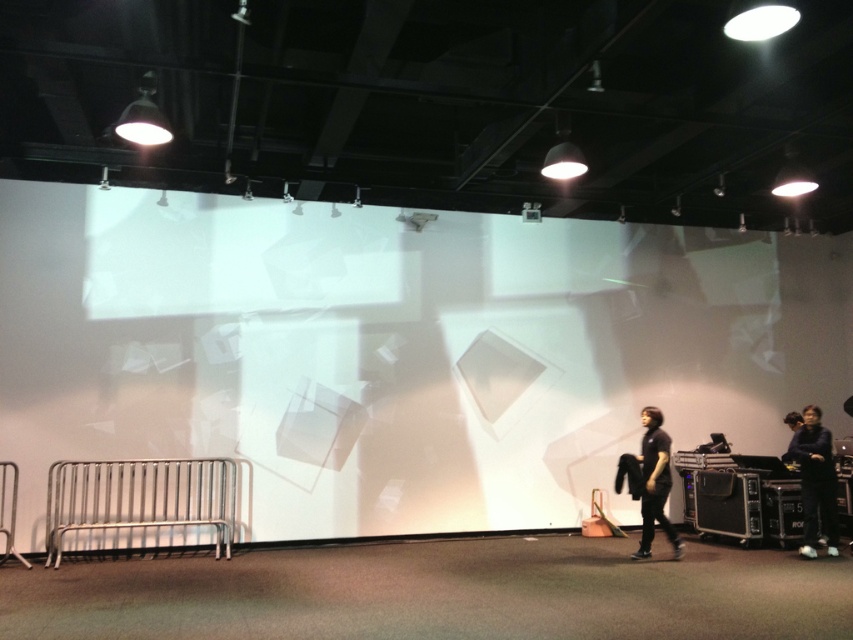
Between dark blue fabric jacket at lower right and dark gray shirt at lower right, which one is positioned higher?

Positioned higher is dark gray shirt at lower right.

Does point (807, 531) lie behind point (664, 490)?

Yes.

Does point (808, 472) lie behind point (676, 554)?

Yes, it is.

Where is `dark blue fabric jacket at lower right`? The image size is (853, 640). dark blue fabric jacket at lower right is located at coordinates (815, 481).